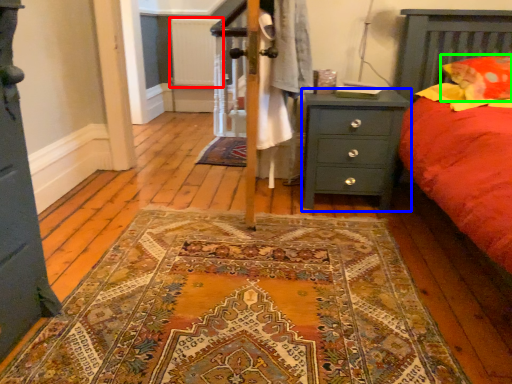
Question: Which object is positioned closest to radiator (highlighted by a red box)? Select from nightstand (highlighted by a blue box) and pillow (highlighted by a green box).

Choices:
 (A) nightstand
 (B) pillow

Answer: (A)